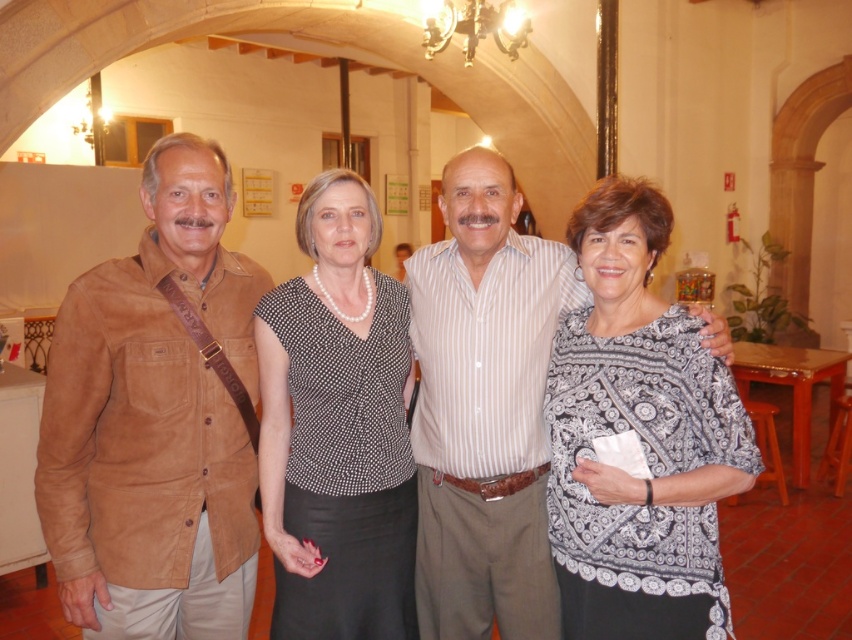
You are organizing a photo shoot and need to ensure that the subjects are spaced appropriately for a group portrait. Given that the recommended minimum distance between subjects in such portraits is 36 inches, will the suede brown jacket at left and the patterned fabric blouse at right meet this requirement?

The distance between the suede brown jacket at left and the patterned fabric blouse at right is 37.85 inches, which exceeds the recommended minimum of 36 inches. Therefore, they meet the spacing requirement.

You are standing in the room and want to locate the suede brown jacket at left. According to the coordinates provided, where is it positioned in the image?

The suede brown jacket at left is positioned at the coordinates point (157, 419) in the image.